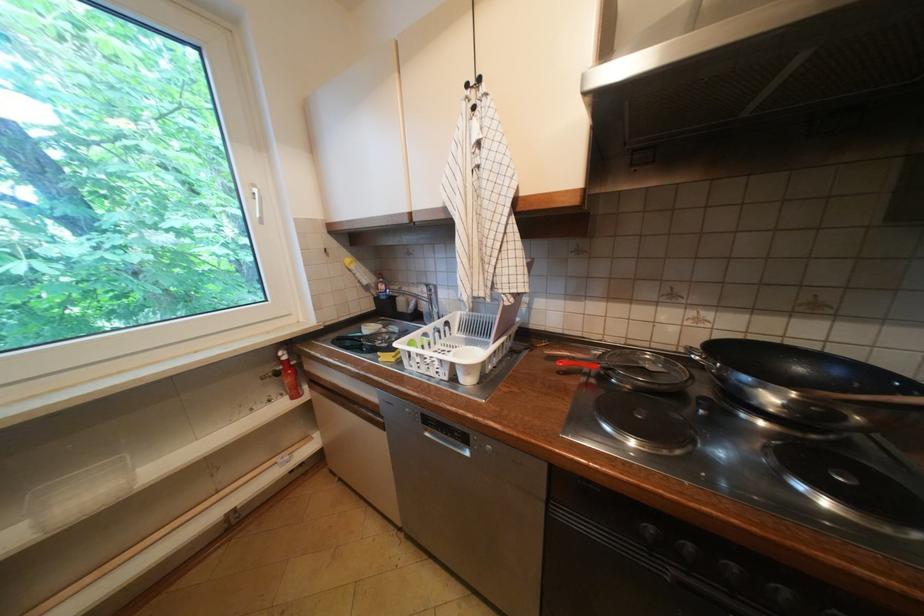
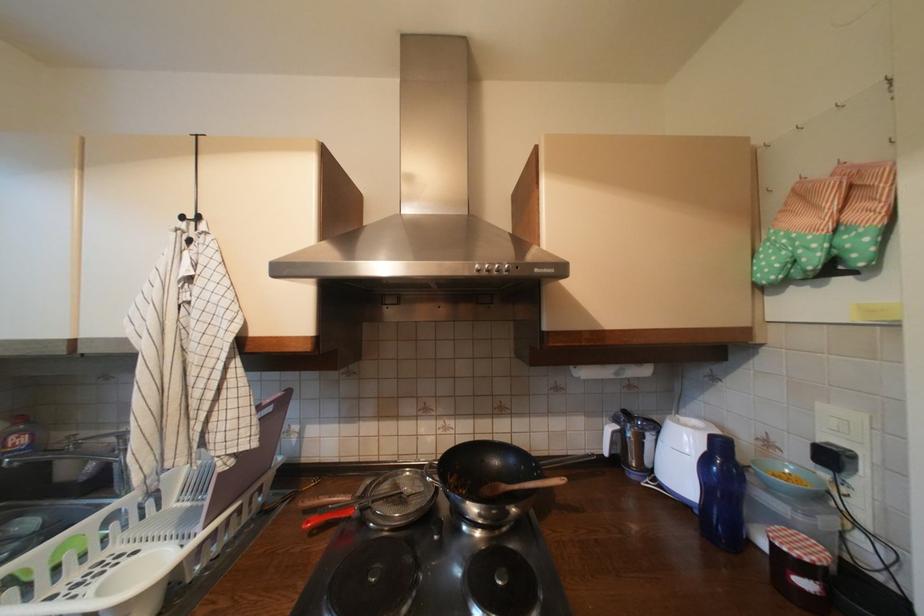
Where in the second image is the point corresponding to (480,84) from the first image?

(197, 219)